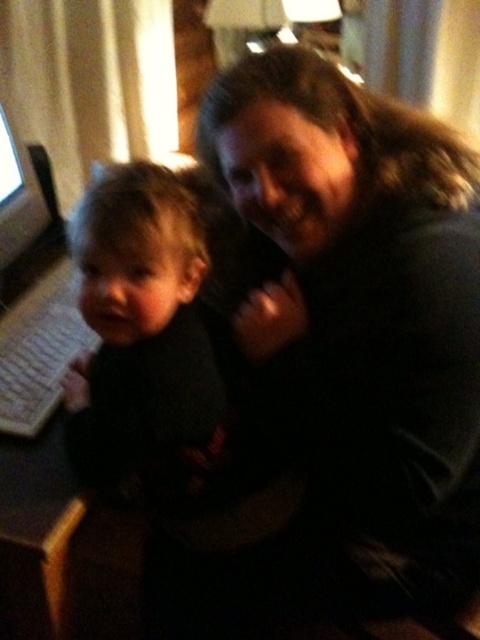
You are a fashion designer observing the scene. You need to determine which item of clothing is more prominent in the visual hierarchy. Based on their positions and sizes in the image, which one between the dark gray sweater at center and the dark matte clothing at center stands out more?

The dark gray sweater at center is much taller than the dark matte clothing at center, making it more prominent in the visual hierarchy.

You are a delivery robot with a package that needs to be placed between the dark gray sweater at center and the matte black monitor at left. The package is 25 inches long. Can you fit the package between them without bending it?

The dark gray sweater at center is 24.74 inches away from the matte black monitor at left. Since the package is 25 inches long, it cannot fit between them as the distance is slightly shorter than the package length.